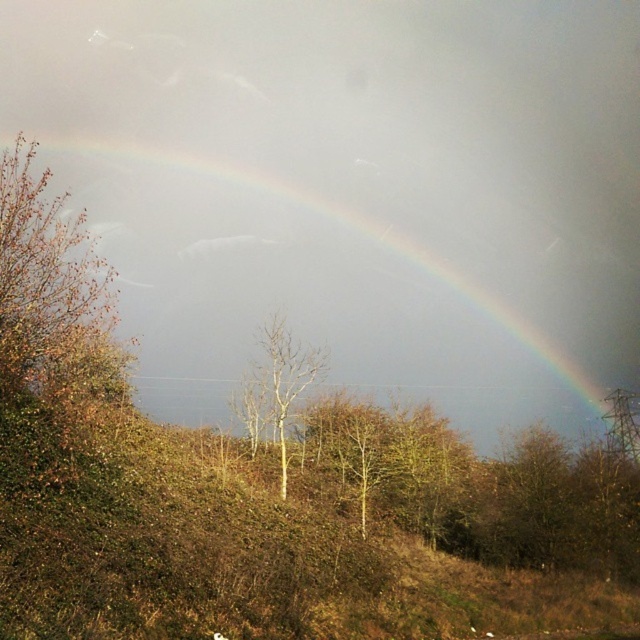
You are an artist painting the landscape. You want to ensure the rainbow at upper center and the bare wood tree at center are positioned correctly according to the scene. Which object should be placed higher in your painting?

The rainbow at upper center should be placed higher than the bare wood tree at center because the rainbow at upper center is above the bare wood tree at center in the scene.

You are standing at the base of the hill and want to take a photo of both the rainbow at upper center and the bare wood tree at center in the same frame. Given that your camera has a standard lens with a field of view of 50 degrees, can you estimate if both objects will fit in the frame without moving your position?

The rainbow at upper center and the bare wood tree at center are 15.68 meters apart from each other. To determine if they fit in a 50 degree field of view, you would need to calculate the angular separation between them. However, without knowing the distance from the camera to the objects, it is impossible to accurately estimate the angle. Therefore, the answer cannot be definitively determined with the given information.